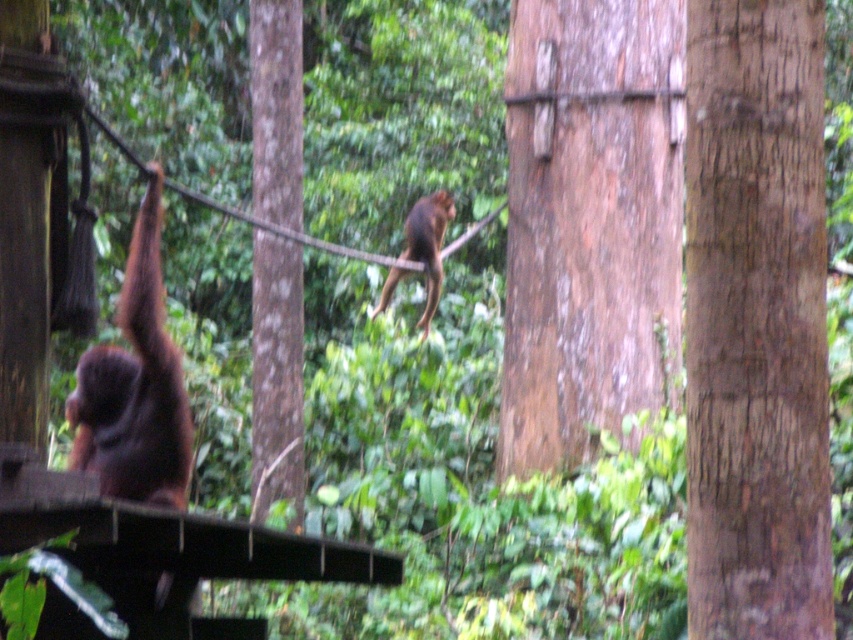
Who is more forward, [584,257] or [433,260]?

Point [584,257]

Which is more to the left, smooth brown tree trunk at center or brown furry monkey at center?

From the viewer's perspective, brown furry monkey at center appears more on the left side.

Is point (566, 172) more distant than point (431, 212)?

No, it is not.

This screenshot has width=853, height=640. I want to click on smooth brown tree trunk at center, so click(590, 221).

Is brown rough bark at center smaller than smooth brown tree trunk at center?

Correct, brown rough bark at center occupies less space than smooth brown tree trunk at center.

Locate an element on the screen. brown rough bark at center is located at coordinates (756, 323).

Who is lower down, smooth brown tree trunk at center or brown furry monkey at left?

brown furry monkey at left is below.

Can you confirm if smooth brown tree trunk at center is shorter than brown furry monkey at left?

No.

I want to click on smooth brown tree trunk at center, so click(x=590, y=221).